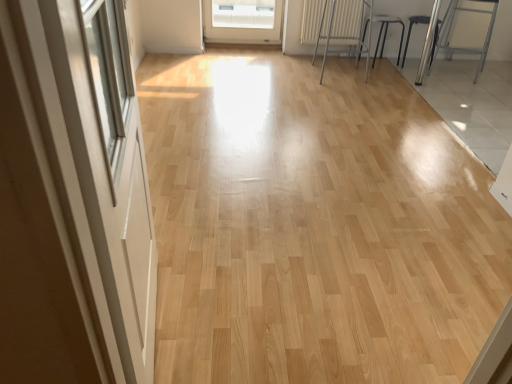
This screenshot has height=384, width=512. What do you see at coordinates (332, 22) in the screenshot?
I see `white textured radiator at upper center` at bounding box center [332, 22].

You are a GUI agent. You are given a task and a screenshot of the screen. Output one action in this format:
    pyautogui.click(x=<x>, y=<y>)
    Task: Click on the white textured radiator at upper center
    This screenshot has height=384, width=512.
    Given the screenshot: What is the action you would take?
    pyautogui.click(x=332, y=22)

Image resolution: width=512 pixels, height=384 pixels. I want to click on metallic silver armchair at right, which is the first armchair in right-to-left order, so click(x=464, y=47).

In the scene shown: What is the approximate height of metallic silver armchair at right, which is the first armchair in right-to-left order?

metallic silver armchair at right, which is the first armchair in right-to-left order, is 29.22 inches tall.

Image resolution: width=512 pixels, height=384 pixels. What do you see at coordinates (344, 27) in the screenshot?
I see `metallic silver radiator at upper center` at bounding box center [344, 27].

What do you see at coordinates (384, 32) in the screenshot? This screenshot has height=384, width=512. I see `metallic silver stool at upper right, which is the 3th armchair from right to left` at bounding box center [384, 32].

Locate an element on the screen. metallic silver stool at upper right, which is the first armchair from left to right is located at coordinates (384, 32).

At what (x,y) coordinates should I click in order to perform the action: click on white textured radiator at upper center. Please return your answer as a coordinate pair (x, y). The image size is (512, 384). Looking at the image, I should click on (332, 22).

Considering the relative sizes of metallic silver armchair at right, which is the first armchair in right-to-left order, and black metal stool at upper right, the 2th armchair viewed from the left, in the image provided, is metallic silver armchair at right, which is the first armchair in right-to-left order, shorter than black metal stool at upper right, the 2th armchair viewed from the left,?

Incorrect, the height of metallic silver armchair at right, which is the first armchair in right-to-left order, does not fall short of that of black metal stool at upper right, the 2th armchair viewed from the left.

The height and width of the screenshot is (384, 512). What are the coordinates of `armchair above the black metal stool at upper right, the second armchair viewed from the right (from a real-world perspective)` in the screenshot? It's located at (464, 47).

Is black metal stool at upper right, the second armchair viewed from the right, completely or partially inside metallic silver armchair at right, the third armchair positioned from the left?

No, black metal stool at upper right, the second armchair viewed from the right, is located outside of metallic silver armchair at right, the third armchair positioned from the left.

Relative to black metal stool at upper right, the second armchair viewed from the right, is metallic silver armchair at right, the third armchair positioned from the left, in front or behind?

In the image, metallic silver armchair at right, the third armchair positioned from the left, appears in front of black metal stool at upper right, the second armchair viewed from the right.

Find the location of a particular element. The image size is (512, 384). armchair that is the 1st one when counting backward from the white glossy screen door at left is located at coordinates (464, 47).

Is white glossy screen door at left to the left or to the right of metallic silver armchair at right, which is the first armchair in right-to-left order, in the image?

Based on their positions, white glossy screen door at left is located to the left of metallic silver armchair at right, which is the first armchair in right-to-left order.

Does white glossy screen door at left have a smaller size compared to metallic silver armchair at right, the third armchair positioned from the left?

Correct, white glossy screen door at left occupies less space than metallic silver armchair at right, the third armchair positioned from the left.

Is white glossy screen door at left looking in the opposite direction of metallic silver armchair at right, the third armchair positioned from the left?

white glossy screen door at left is not turned away from metallic silver armchair at right, the third armchair positioned from the left.

Is metallic silver stool at upper right, which is the first armchair from left to right, taller than metallic silver radiator at upper center?

Incorrect, the height of metallic silver stool at upper right, which is the first armchair from left to right, is not larger of that of metallic silver radiator at upper center.

Considering the sizes of metallic silver stool at upper right, which is the 3th armchair from right to left, and metallic silver radiator at upper center in the image, is metallic silver stool at upper right, which is the 3th armchair from right to left, bigger or smaller than metallic silver radiator at upper center?

Considering their sizes, metallic silver stool at upper right, which is the 3th armchair from right to left, takes up less space than metallic silver radiator at upper center.

From a real-world perspective, which object stands above the other?

From a 3D spatial view, metallic silver radiator at upper center is above.

Considering the positions of point (397, 22) and point (345, 31), is point (397, 22) closer or farther from the camera than point (345, 31)?

Clearly, point (397, 22) is closer to the camera than point (345, 31).

Would you say metallic silver radiator at upper center is inside or outside white textured radiator at upper center?

metallic silver radiator at upper center exists outside the volume of white textured radiator at upper center.

Would you say metallic silver radiator at upper center is to the left or to the right of white textured radiator at upper center in the picture?

Based on their positions, metallic silver radiator at upper center is located to the right of white textured radiator at upper center.

Could you tell me if metallic silver radiator at upper center is facing white textured radiator at upper center?

No, metallic silver radiator at upper center is not facing towards white textured radiator at upper center.

Does metallic silver radiator at upper center touch white textured radiator at upper center?

Absolutely, metallic silver radiator at upper center is next to and touching white textured radiator at upper center.

From the picture: Can you confirm if metallic silver armchair at right, which is the first armchair in right-to-left order, is thinner than metallic silver stool at upper right, which is the first armchair from left to right?

No, metallic silver armchair at right, which is the first armchair in right-to-left order, is not thinner than metallic silver stool at upper right, which is the first armchair from left to right.

Based on the photo, can you confirm if metallic silver armchair at right, which is the first armchair in right-to-left order, is bigger than metallic silver stool at upper right, which is the 3th armchair from right to left?

Indeed, metallic silver armchair at right, which is the first armchair in right-to-left order, has a larger size compared to metallic silver stool at upper right, which is the 3th armchair from right to left.

Does metallic silver armchair at right, the third armchair positioned from the left, have a greater height compared to metallic silver stool at upper right, which is the 3th armchair from right to left?

Indeed, metallic silver armchair at right, the third armchair positioned from the left, has a greater height compared to metallic silver stool at upper right, which is the 3th armchair from right to left.

Is metallic silver armchair at right, which is the first armchair in right-to-left order, with metallic silver stool at upper right, which is the 3th armchair from right to left?

No, metallic silver armchair at right, which is the first armchair in right-to-left order, is not making contact with metallic silver stool at upper right, which is the 3th armchair from right to left.

Who is smaller, white textured radiator at upper center or white glossy screen door at left?

With smaller size is white textured radiator at upper center.

From the image's perspective, is white textured radiator at upper center positioned above or below white glossy screen door at left?

Based on their image positions, white textured radiator at upper center is located above white glossy screen door at left.

How many degrees apart are the facing directions of white textured radiator at upper center and white glossy screen door at left?

The facing directions of white textured radiator at upper center and white glossy screen door at left are 96.5 degrees apart.

From a real-world perspective, between white textured radiator at upper center and white glossy screen door at left, who is vertically lower?

white textured radiator at upper center is physically lower.

From the image's perspective, which is above, metallic silver radiator at upper center or black metal stool at upper right, the 2th armchair viewed from the left?

black metal stool at upper right, the 2th armchair viewed from the left, appears higher in the image.

Does metallic silver radiator at upper center have a greater width compared to black metal stool at upper right, the 2th armchair viewed from the left?

Correct, the width of metallic silver radiator at upper center exceeds that of black metal stool at upper right, the 2th armchair viewed from the left.

How many degrees apart are the facing directions of metallic silver radiator at upper center and black metal stool at upper right, the 2th armchair viewed from the left?

The angular difference between metallic silver radiator at upper center and black metal stool at upper right, the 2th armchair viewed from the left, is 90 degrees.

Is metallic silver radiator at upper center next to black metal stool at upper right, the 2th armchair viewed from the left?

No, metallic silver radiator at upper center is not making contact with black metal stool at upper right, the 2th armchair viewed from the left.

Identify the location of the 1st armchair to the left when counting from the metallic silver armchair at right, the third armchair positioned from the left. coord(426,39).

This screenshot has width=512, height=384. What are the coordinates of `the 1st armchair above when counting from the white glossy screen door at left (from the image's perspective)` in the screenshot? It's located at (464, 47).

Looking at the image, which one is located closer to metallic silver armchair at right, the third armchair positioned from the left, metallic silver stool at upper right, which is the 3th armchair from right to left, or black metal stool at upper right, the 2th armchair viewed from the left?

black metal stool at upper right, the 2th armchair viewed from the left.

Considering their positions, is metallic silver armchair at right, which is the first armchair in right-to-left order, positioned closer to metallic silver radiator at upper center than white glossy screen door at left?

metallic silver armchair at right, which is the first armchair in right-to-left order, lies closer to metallic silver radiator at upper center than the other object.

Estimate the real-world distances between objects in this image. Which object is further from metallic silver stool at upper right, which is the first armchair from left to right, metallic silver radiator at upper center or white glossy screen door at left?

white glossy screen door at left lies further to metallic silver stool at upper right, which is the first armchair from left to right, than the other object.

Based on their spatial positions, is black metal stool at upper right, the 2th armchair viewed from the left, or metallic silver radiator at upper center further from white textured radiator at upper center?

black metal stool at upper right, the 2th armchair viewed from the left, lies further to white textured radiator at upper center than the other object.

From the image, which object appears to be nearer to white textured radiator at upper center, black metal stool at upper right, the second armchair viewed from the right, or white glossy screen door at left?

Among the two, black metal stool at upper right, the second armchair viewed from the right, is located nearer to white textured radiator at upper center.

Estimate the real-world distances between objects in this image. Which object is further from black metal stool at upper right, the second armchair viewed from the right, white glossy screen door at left or white textured radiator at upper center?

white glossy screen door at left is further to black metal stool at upper right, the second armchair viewed from the right.

When comparing their distances from metallic silver armchair at right, the third armchair positioned from the left, does metallic silver stool at upper right, which is the first armchair from left to right, or white glossy screen door at left seem further?

white glossy screen door at left is further to metallic silver armchair at right, the third armchair positioned from the left.

From the image, which object appears to be farther from black metal stool at upper right, the second armchair viewed from the right, metallic silver stool at upper right, which is the 3th armchair from right to left, or metallic silver armchair at right, which is the first armchair in right-to-left order?

Based on the image, metallic silver armchair at right, which is the first armchair in right-to-left order, appears to be further to black metal stool at upper right, the second armchair viewed from the right.

Where is `furniture positioned between white glossy screen door at left and white textured radiator at upper center from near to far`? This screenshot has width=512, height=384. furniture positioned between white glossy screen door at left and white textured radiator at upper center from near to far is located at coordinates (344, 27).

Where is `armchair between metallic silver stool at upper right, which is the 3th armchair from right to left, and metallic silver armchair at right, the third armchair positioned from the left`? The width and height of the screenshot is (512, 384). armchair between metallic silver stool at upper right, which is the 3th armchair from right to left, and metallic silver armchair at right, the third armchair positioned from the left is located at coordinates (426, 39).

Identify the location of furniture positioned between white glossy screen door at left and metallic silver stool at upper right, which is the 3th armchair from right to left, from near to far. (344, 27).

The width and height of the screenshot is (512, 384). I want to click on furniture situated between white textured radiator at upper center and black metal stool at upper right, the second armchair viewed from the right, from left to right, so click(x=344, y=27).